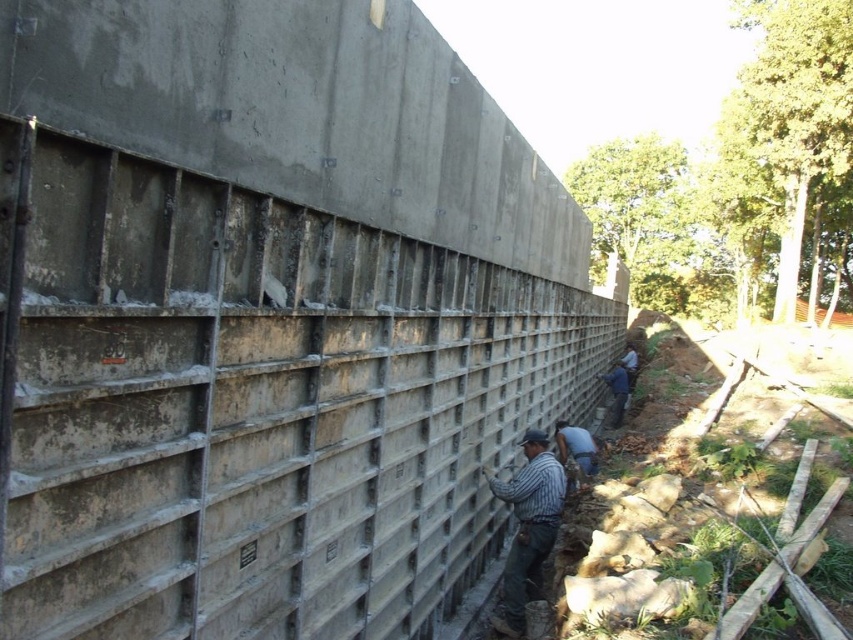
Question: Is blue jeans at lower right to the left of blue denim shirt at lower right from the viewer's perspective?

Choices:
 (A) no
 (B) yes

Answer: (B)

Question: Which point is closer to the camera?

Choices:
 (A) concrete wall at left
 (B) blue denim shirt at lower right

Answer: (A)

Question: From the image, what is the correct spatial relationship of concrete wall at left in relation to blue denim shirt at lower right?

Choices:
 (A) left
 (B) right

Answer: (A)

Question: Can you confirm if concrete wall at left is wider than blue jeans at lower right?

Choices:
 (A) no
 (B) yes

Answer: (B)

Question: Which point is closer to the camera?

Choices:
 (A) blue jeans at lower right
 (B) concrete wall at left
 (C) blue denim shirt at lower right
 (D) striped cotton shirt at center

Answer: (B)

Question: Considering the real-world distances, which object is closest to the concrete wall at left?

Choices:
 (A) blue jeans at lower right
 (B) striped cotton shirt at center

Answer: (B)